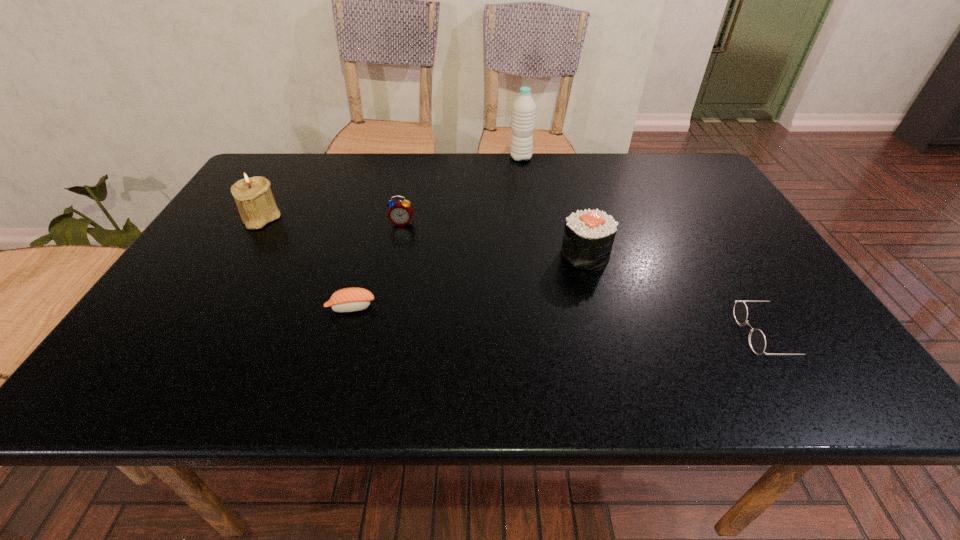
This screenshot has height=540, width=960. I want to click on empty space that is in between the nearer sushi and the farther sushi, so click(x=468, y=281).

Identify the location of free spot between the farthest object and the fourth shortest object. Image resolution: width=960 pixels, height=540 pixels. (553, 206).

This screenshot has width=960, height=540. I want to click on vacant point located between the second object from right to left and the alarm clock, so click(493, 239).

The width and height of the screenshot is (960, 540). Find the location of `vacant area that lies between the fourth object from left to right and the nearer sushi`. vacant area that lies between the fourth object from left to right and the nearer sushi is located at coordinates (436, 233).

I want to click on vacant point located between the alarm clock and the tallest object, so click(462, 190).

Where is `vacant space that's between the fourth shortest object and the rightmost object`? vacant space that's between the fourth shortest object and the rightmost object is located at coordinates (681, 295).

Locate an element on the screen. vacant area between the spectacles and the left sushi is located at coordinates tap(564, 321).

This screenshot has width=960, height=540. I want to click on vacant point located between the nearer sushi and the tallest object, so click(436, 233).

You are a GUI agent. You are given a task and a screenshot of the screen. Output one action in this format:
    pyautogui.click(x=<x>, y=<y>)
    Task: Click on the object that is the fourth closest to the spectacles
    This screenshot has width=960, height=540.
    Given the screenshot: What is the action you would take?
    pyautogui.click(x=400, y=212)

Where is `the third closest object to the candle_holder`? This screenshot has width=960, height=540. the third closest object to the candle_holder is located at coordinates (524, 108).